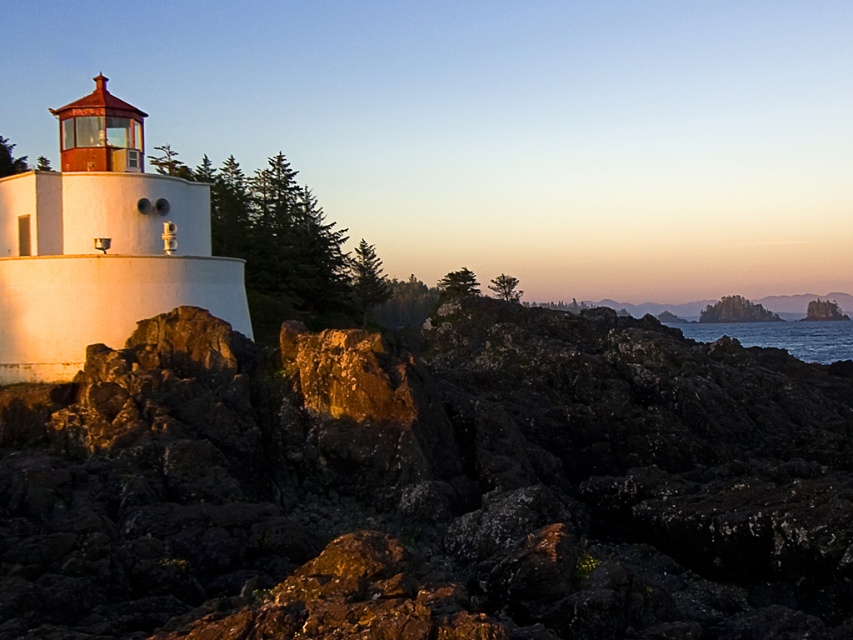
Question: Can you confirm if rough textured rock at left is positioned to the left of blue water at lower right?

Choices:
 (A) yes
 (B) no

Answer: (A)

Question: Which point appears closest to the camera in this image?

Choices:
 (A) (495, 636)
 (B) (88, 147)

Answer: (A)

Question: Is white matte lighthouse at left thinner than blue water at lower right?

Choices:
 (A) no
 (B) yes

Answer: (B)

Question: Which point appears closest to the camera in this image?

Choices:
 (A) (50, 230)
 (B) (811, 349)
 (C) (276, 557)

Answer: (C)

Question: Which point is closer to the camera?

Choices:
 (A) rough textured rock at left
 (B) white matte lighthouse at left

Answer: (A)

Question: Can you confirm if white matte lighthouse at left is bigger than blue water at lower right?

Choices:
 (A) yes
 (B) no

Answer: (B)